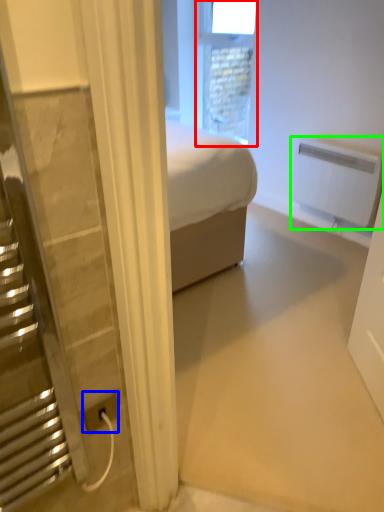
Question: Based on their relative distances, which object is farther from window (highlighted by a red box)? Choose from power plugs and sockets (highlighted by a blue box) and radiator (highlighted by a green box).

Choices:
 (A) power plugs and sockets
 (B) radiator

Answer: (A)